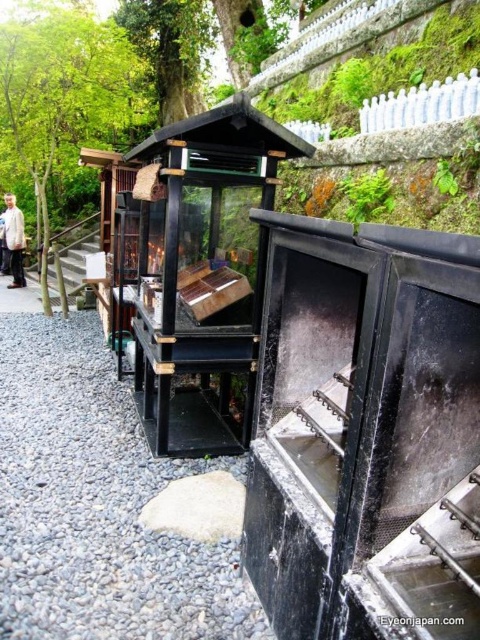
You are standing in the Japanese garden and want to take a photo of the point at coordinates (94, 332). The camera you have can focus on objects up to 7 meters away. Will the point be in focus?

The distance of point (94, 332) from the viewer is 7.38 meters, which is beyond the camera focus limit of 7 meters. Therefore, the point will not be in focus.

You are standing in a traditional Japanese garden and see the gray gravel at lower left and the white cotton shirt at left. Which object is positioned further to the right from your perspective?

The gray gravel at lower left is positioned to the right of the white cotton shirt at left, so the gray gravel at lower left is further to the right.

You are standing at the entrance of the garden and want to walk towards the wooden structure with the lit candle. Which direction should you head relative to the gray gravel path at left and the gray gravel at lower left?

You should head to the right of the gray gravel path at left because the gray gravel at lower left is located to its right, indicating the direction towards the wooden structure.